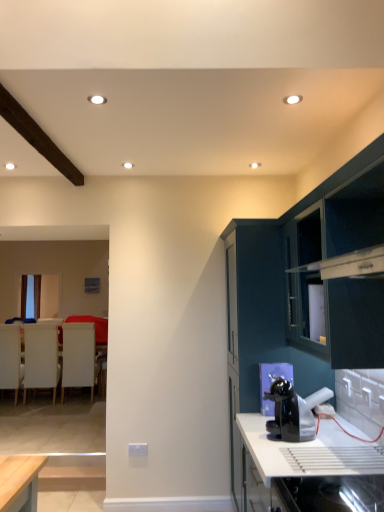
How much space does white matte armchair at left, which is counted as the second armchair, starting from the left, occupy vertically?

It is 3.58 feet.

Describe the element at coordinates (338, 264) in the screenshot. I see `dark green cabinet at upper right, which is counted as the 1th cabinetry, starting from the front` at that location.

The image size is (384, 512). What do you see at coordinates (305, 281) in the screenshot?
I see `glossy dark teal cabinet at right, marked as the second cabinetry in a front-to-back arrangement` at bounding box center [305, 281].

Where is `white fabric armchair at left, the 1th armchair in the left-to-right sequence`? white fabric armchair at left, the 1th armchair in the left-to-right sequence is located at coordinates (10, 358).

Between white glossy countertop at lower right and glossy dark teal cabinet at right, marked as the second cabinetry in a front-to-back arrangement, which one has more height?

With more height is glossy dark teal cabinet at right, marked as the second cabinetry in a front-to-back arrangement.

Locate an element on the screen. the 1st cabinetry positioned above the white glossy countertop at lower right (from the image's perspective) is located at coordinates (305, 281).

Is white glossy countertop at lower right positioned with its back to glossy dark teal cabinet at right, which appears as the 1th cabinetry when viewed from the back?

white glossy countertop at lower right is not turned away from glossy dark teal cabinet at right, which appears as the 1th cabinetry when viewed from the back.

From the image's perspective, is white glossy countertop at lower right on glossy dark teal cabinet at right, which appears as the 1th cabinetry when viewed from the back?

Actually, white glossy countertop at lower right appears below glossy dark teal cabinet at right, which appears as the 1th cabinetry when viewed from the back, in the image.

This screenshot has height=512, width=384. Identify the location of armchair that is the 2nd one when counting rightward from the white fabric armchair at left, the 1th armchair in the left-to-right sequence. (78, 357).

Is white fabric armchair at left, which is counted as the 3th armchair, starting from the right, not within white fabric armchair at left, acting as the 3th armchair starting from the left?

That's correct, white fabric armchair at left, which is counted as the 3th armchair, starting from the right, is outside of white fabric armchair at left, acting as the 3th armchair starting from the left.

From the image's perspective, does white fabric armchair at left, which is counted as the 3th armchair, starting from the right, appear lower than white fabric armchair at left, the 1th armchair when ordered from right to left?

Yes, from the image's perspective, white fabric armchair at left, which is counted as the 3th armchair, starting from the right, is beneath white fabric armchair at left, the 1th armchair when ordered from right to left.

Is white fabric armchair at left, the 1th armchair in the left-to-right sequence, thinner than white fabric armchair at left, acting as the 3th armchair starting from the left?

Incorrect, the width of white fabric armchair at left, the 1th armchair in the left-to-right sequence, is not less than that of white fabric armchair at left, acting as the 3th armchair starting from the left.

Identify the location of the 1st armchair below the black glossy coffee machine at lower center (from the image's perspective). (41, 358).

Which of these two, black glossy coffee machine at lower center or white matte armchair at left, which is counted as the second armchair, starting from the left, is wider?

white matte armchair at left, which is counted as the second armchair, starting from the left, is wider.

Does black glossy coffee machine at lower center touch white matte armchair at left, which is counted as the second armchair, starting from the left?

No, black glossy coffee machine at lower center is not next to white matte armchair at left, which is counted as the second armchair, starting from the left.

Does white fabric armchair at left, acting as the 3th armchair starting from the left, contain glossy dark teal cabinet at right, which appears as the 1th cabinetry when viewed from the back?

No, white fabric armchair at left, acting as the 3th armchair starting from the left, does not contain glossy dark teal cabinet at right, which appears as the 1th cabinetry when viewed from the back.

Is white fabric armchair at left, the 1th armchair when ordered from right to left, positioned behind glossy dark teal cabinet at right, which appears as the 1th cabinetry when viewed from the back?

That is True.

From a real-world perspective, is white fabric armchair at left, the 1th armchair when ordered from right to left, physically located above or below glossy dark teal cabinet at right, which appears as the 1th cabinetry when viewed from the back?

white fabric armchair at left, the 1th armchair when ordered from right to left, is situated lower than glossy dark teal cabinet at right, which appears as the 1th cabinetry when viewed from the back, in the real world.

How many degrees apart are the facing directions of white fabric armchair at left, the 1th armchair when ordered from right to left, and glossy dark teal cabinet at right, which appears as the 1th cabinetry when viewed from the back?

The angle between the facing direction of white fabric armchair at left, the 1th armchair when ordered from right to left, and the facing direction of glossy dark teal cabinet at right, which appears as the 1th cabinetry when viewed from the back, is 92.7 degrees.

From the image's perspective, is white fabric armchair at left, the 1th armchair in the left-to-right sequence, positioned above or below white matte armchair at left, the 2th armchair positioned from the right?

white fabric armchair at left, the 1th armchair in the left-to-right sequence, is situated lower than white matte armchair at left, the 2th armchair positioned from the right, in the image.

Considering the points (7, 372) and (42, 353), which point is behind, point (7, 372) or point (42, 353)?

Positioned behind is point (42, 353).

Is white fabric armchair at left, which is counted as the 3th armchair, starting from the right, turned away from white matte armchair at left, which is counted as the second armchair, starting from the left?

white fabric armchair at left, which is counted as the 3th armchair, starting from the right, is not turned away from white matte armchair at left, which is counted as the second armchair, starting from the left.

Between white fabric armchair at left, the 1th armchair in the left-to-right sequence, and white matte armchair at left, the 2th armchair positioned from the right, which one has larger size?

white fabric armchair at left, the 1th armchair in the left-to-right sequence, is bigger.

Image resolution: width=384 pixels, height=512 pixels. In order to click on the 2nd armchair below when counting from the white matte armchair at left, which is counted as the second armchair, starting from the left (from the image's perspective) in this screenshot , I will do pyautogui.click(x=10, y=358).

Is white fabric armchair at left, the 1th armchair in the left-to-right sequence, at the back of white matte armchair at left, which is counted as the second armchair, starting from the left?

No, white fabric armchair at left, the 1th armchair in the left-to-right sequence, is not at the back of white matte armchair at left, which is counted as the second armchair, starting from the left.

How different are the orientations of white matte armchair at left, which is counted as the second armchair, starting from the left, and white fabric armchair at left, which is counted as the 3th armchair, starting from the right, in degrees?

The angle between the facing direction of white matte armchair at left, which is counted as the second armchair, starting from the left, and the facing direction of white fabric armchair at left, which is counted as the 3th armchair, starting from the right, is 0.663 degrees.

Considering the sizes of objects white matte armchair at left, which is counted as the second armchair, starting from the left, and white fabric armchair at left, the 1th armchair in the left-to-right sequence, in the image provided, who is wider, white matte armchair at left, which is counted as the second armchair, starting from the left, or white fabric armchair at left, the 1th armchair in the left-to-right sequence,?

white fabric armchair at left, the 1th armchair in the left-to-right sequence, is wider.

From the image's perspective, does white matte armchair at left, the 2th armchair positioned from the right, appear lower than white glossy countertop at lower right?

Yes.

Is white matte armchair at left, the 2th armchair positioned from the right, not within white glossy countertop at lower right?

Absolutely, white matte armchair at left, the 2th armchair positioned from the right, is external to white glossy countertop at lower right.

Between white matte armchair at left, the 2th armchair positioned from the right, and white glossy countertop at lower right, which one has smaller size?

Smaller between the two is white matte armchair at left, the 2th armchair positioned from the right.

Is point (56, 359) farther from viewer compared to point (245, 476)?

Yes, point (56, 359) is behind point (245, 476).

Locate an element on the screen. The image size is (384, 512). countertop to the right of glossy dark teal cabinet at right, marked as the second cabinetry in a front-to-back arrangement is located at coordinates (304, 453).

The height and width of the screenshot is (512, 384). What are the coordinates of `armchair below the white fabric armchair at left, acting as the 3th armchair starting from the left (from the image's perspective)` in the screenshot? It's located at (10, 358).

Estimate the real-world distances between objects in this image. Which object is closer to white fabric armchair at left, the 1th armchair in the left-to-right sequence, white glossy countertop at lower right or glossy dark teal cabinet at right, which appears as the 1th cabinetry when viewed from the back?

A: glossy dark teal cabinet at right, which appears as the 1th cabinetry when viewed from the back, is closer to white fabric armchair at left, the 1th armchair in the left-to-right sequence.

From the picture: Which object lies further to the anchor point white fabric armchair at left, acting as the 3th armchair starting from the left, white glossy countertop at lower right or glossy dark teal cabinet at right, marked as the second cabinetry in a front-to-back arrangement?

Based on the image, white glossy countertop at lower right appears to be further to white fabric armchair at left, acting as the 3th armchair starting from the left.

Which object lies further to the anchor point white matte armchair at left, which is counted as the second armchair, starting from the left, black glossy coffee machine at lower center or white fabric armchair at left, which is counted as the 3th armchair, starting from the right?

black glossy coffee machine at lower center is positioned further to the anchor white matte armchair at left, which is counted as the second armchair, starting from the left.

When comparing their distances from white fabric armchair at left, acting as the 3th armchair starting from the left, does white glossy countertop at lower right or black glossy coffee machine at lower center seem closer?

The object closer to white fabric armchair at left, acting as the 3th armchair starting from the left, is black glossy coffee machine at lower center.

From the image, which object appears to be farther from black glossy coffee machine at lower center, white fabric armchair at left, which is counted as the 3th armchair, starting from the right, or white matte armchair at left, the 2th armchair positioned from the right?

white fabric armchair at left, which is counted as the 3th armchair, starting from the right, is positioned further to the anchor black glossy coffee machine at lower center.

When comparing their distances from dark green cabinet at upper right, which is counted as the 1th cabinetry, starting from the front, does black glossy coffee machine at lower center or white glossy countertop at lower right seem further?

white glossy countertop at lower right lies further to dark green cabinet at upper right, which is counted as the 1th cabinetry, starting from the front, than the other object.

From the image, which object appears to be farther from white matte armchair at left, the 2th armchair positioned from the right, white glossy countertop at lower right or dark green cabinet at upper right, the second cabinetry viewed from the back?

dark green cabinet at upper right, the second cabinetry viewed from the back.

From the image, which object appears to be nearer to dark green cabinet at upper right, which is counted as the 1th cabinetry, starting from the front, white matte armchair at left, the 2th armchair positioned from the right, or white glossy countertop at lower right?

Based on the image, white glossy countertop at lower right appears to be nearer to dark green cabinet at upper right, which is counted as the 1th cabinetry, starting from the front.

Image resolution: width=384 pixels, height=512 pixels. Find the location of `cabinetry between dark green cabinet at upper right, which is counted as the 1th cabinetry, starting from the front, and white fabric armchair at left, the 1th armchair when ordered from right to left, from front to back`. cabinetry between dark green cabinet at upper right, which is counted as the 1th cabinetry, starting from the front, and white fabric armchair at left, the 1th armchair when ordered from right to left, from front to back is located at coordinates (305, 281).

Locate an element on the screen. The height and width of the screenshot is (512, 384). armchair situated between white fabric armchair at left, which is counted as the 3th armchair, starting from the right, and white fabric armchair at left, acting as the 3th armchair starting from the left, from left to right is located at coordinates (41, 358).

The image size is (384, 512). In order to click on appliance between white glossy countertop at lower right and white matte armchair at left, which is counted as the second armchair, starting from the left, from front to back in this screenshot , I will do `click(293, 411)`.

Where is `cabinetry located between black glossy coffee machine at lower center and white matte armchair at left, which is counted as the second armchair, starting from the left, in the depth direction`? cabinetry located between black glossy coffee machine at lower center and white matte armchair at left, which is counted as the second armchair, starting from the left, in the depth direction is located at coordinates (305, 281).